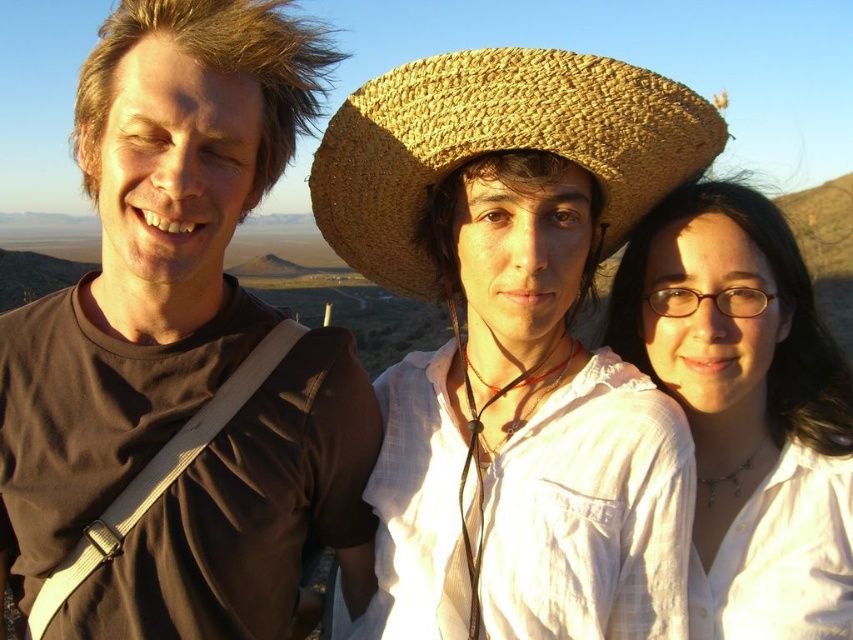
Question: Which of the following is the farthest from the observer?

Choices:
 (A) (210, 326)
 (B) (718, 154)
 (C) (762, 365)

Answer: (C)

Question: Is brown matte shirt at left to the left of woven straw cowboy hat at center from the viewer's perspective?

Choices:
 (A) yes
 (B) no

Answer: (A)

Question: Can you confirm if white matte shirt at center is wider than woven straw cowboy hat at center?

Choices:
 (A) no
 (B) yes

Answer: (B)

Question: Which object is the farthest from the white matte shirt at center?

Choices:
 (A) woven straw cowboy hat at center
 (B) natural straw hat at center
 (C) brown matte shirt at left

Answer: (C)

Question: Which point appears farthest from the camera in this image?

Choices:
 (A) pyautogui.click(x=732, y=362)
 (B) pyautogui.click(x=12, y=525)
 (C) pyautogui.click(x=384, y=193)

Answer: (A)

Question: Can you confirm if natural straw hat at center is positioned above woven straw cowboy hat at center?

Choices:
 (A) no
 (B) yes

Answer: (A)